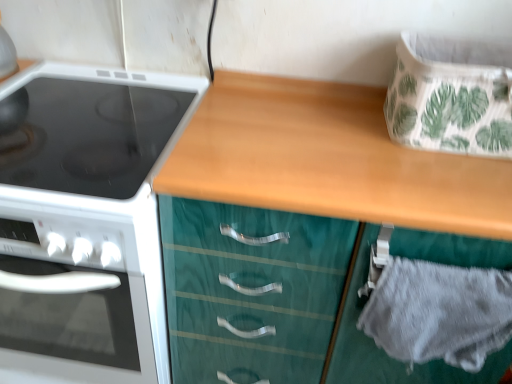
What do you see at coordinates (86, 219) in the screenshot? I see `white glossy electric stove at left` at bounding box center [86, 219].

The width and height of the screenshot is (512, 384). I want to click on teal wood cabinet at center, the 1th cabinetry in the front-to-back sequence, so click(252, 290).

The width and height of the screenshot is (512, 384). I want to click on white glossy electric stove at left, so click(x=86, y=219).

From the image's perspective, is gray fabric drawer at lower right, which ranks as the 2th cabinetry in front-to-back order, on top of white glossy electric stove at left?

Yes, from the image's perspective, gray fabric drawer at lower right, which ranks as the 2th cabinetry in front-to-back order, is above white glossy electric stove at left.

Is gray fabric drawer at lower right, the 1th cabinetry from the back, completely or partially outside of white glossy electric stove at left?

Yes, gray fabric drawer at lower right, the 1th cabinetry from the back, is outside of white glossy electric stove at left.

Is gray fabric drawer at lower right, which ranks as the 2th cabinetry in front-to-back order, shorter than white glossy electric stove at left?

Correct, gray fabric drawer at lower right, which ranks as the 2th cabinetry in front-to-back order, is not as tall as white glossy electric stove at left.

Between gray fabric drawer at lower right, the 1th cabinetry from the back, and white glossy electric stove at left, which one appears on the left side from the viewer's perspective?

white glossy electric stove at left is more to the left.

Between point (445, 246) and point (161, 218), which one is positioned behind?

The point (161, 218) is behind.

Can you see gray fabric drawer at lower right, which ranks as the 2th cabinetry in front-to-back order, touching teal wood cabinet at center, placed as the 2th cabinetry when sorted from back to front?

gray fabric drawer at lower right, which ranks as the 2th cabinetry in front-to-back order, and teal wood cabinet at center, placed as the 2th cabinetry when sorted from back to front, are clearly separated.

Would you say gray fabric drawer at lower right, which ranks as the 2th cabinetry in front-to-back order, is outside teal wood cabinet at center, placed as the 2th cabinetry when sorted from back to front?

That's incorrect, gray fabric drawer at lower right, which ranks as the 2th cabinetry in front-to-back order, is not completely outside teal wood cabinet at center, placed as the 2th cabinetry when sorted from back to front.

Could you measure the distance between gray fabric drawer at lower right, which ranks as the 2th cabinetry in front-to-back order, and teal wood cabinet at center, placed as the 2th cabinetry when sorted from back to front?

4.84 inches.

Does white glossy electric stove at left turn towards teal wood cabinet at center, placed as the 2th cabinetry when sorted from back to front?

No, white glossy electric stove at left is not turned towards teal wood cabinet at center, placed as the 2th cabinetry when sorted from back to front.

Does white glossy electric stove at left come behind teal wood cabinet at center, the 1th cabinetry in the front-to-back sequence?

Yes.

Does point (130, 140) appear closer or farther from the camera than point (458, 251)?

Point (130, 140) is positioned farther from the camera compared to point (458, 251).

Does point (254, 357) come closer to viewer compared to point (118, 335)?

No, it is not.

How many degrees apart are the facing directions of teal wood cabinet at center, placed as the 2th cabinetry when sorted from back to front, and white glossy electric stove at left?

There is a 0.000492-degree angle between the facing directions of teal wood cabinet at center, placed as the 2th cabinetry when sorted from back to front, and white glossy electric stove at left.

From the image's perspective, is teal wood cabinet at center, the 1th cabinetry in the front-to-back sequence, on white glossy electric stove at left?

Yes, from the image's perspective, teal wood cabinet at center, the 1th cabinetry in the front-to-back sequence, is above white glossy electric stove at left.

Could you tell me if teal wood cabinet at center, the 1th cabinetry in the front-to-back sequence, is turned towards white glossy electric stove at left?

No, teal wood cabinet at center, the 1th cabinetry in the front-to-back sequence, is not facing towards white glossy electric stove at left.

Does point (188, 213) come in front of point (398, 365)?

That is True.

Does teal wood cabinet at center, the 1th cabinetry in the front-to-back sequence, touch gray fabric drawer at lower right, the 1th cabinetry from the back?

No.

Is teal wood cabinet at center, placed as the 2th cabinetry when sorted from back to front, shorter than gray fabric drawer at lower right, which ranks as the 2th cabinetry in front-to-back order?

No, teal wood cabinet at center, placed as the 2th cabinetry when sorted from back to front, is not shorter than gray fabric drawer at lower right, which ranks as the 2th cabinetry in front-to-back order.

Would you say teal wood cabinet at center, placed as the 2th cabinetry when sorted from back to front, is to the left or to the right of gray fabric drawer at lower right, which ranks as the 2th cabinetry in front-to-back order, in the picture?

teal wood cabinet at center, placed as the 2th cabinetry when sorted from back to front, is positioned on gray fabric drawer at lower right, which ranks as the 2th cabinetry in front-to-back order,'s left side.

Is the surface of white glossy electric stove at left in direct contact with gray fabric drawer at lower right, which ranks as the 2th cabinetry in front-to-back order?

No.

From a real-world perspective, relative to gray fabric drawer at lower right, which ranks as the 2th cabinetry in front-to-back order, is white glossy electric stove at left vertically above or below?

From a real-world perspective, white glossy electric stove at left is physically below gray fabric drawer at lower right, which ranks as the 2th cabinetry in front-to-back order.

Based on the photo, is white glossy electric stove at left positioned behind gray fabric drawer at lower right, the 1th cabinetry from the back?

Yes, white glossy electric stove at left is further from the viewer.

You are a GUI agent. You are given a task and a screenshot of the screen. Output one action in this format:
    pyautogui.click(x=<x>, y=<y>)
    Task: Click on the kitchen appliance located underneath the gray fabric drawer at lower right, which ranks as the 2th cabinetry in front-to-back order (from a real-world perspective)
    
    Given the screenshot: What is the action you would take?
    pyautogui.click(x=86, y=219)

This screenshot has width=512, height=384. In order to click on cabinetry lying below the teal wood cabinet at center, placed as the 2th cabinetry when sorted from back to front (from the image's perspective) in this screenshot , I will do `click(384, 353)`.

Based on their spatial positions, is white glossy electric stove at left or teal wood cabinet at center, the 1th cabinetry in the front-to-back sequence, further from gray fabric drawer at lower right, the 1th cabinetry from the back?

white glossy electric stove at left lies further to gray fabric drawer at lower right, the 1th cabinetry from the back, than the other object.

Looking at this image, which object lies further to the anchor point white glossy electric stove at left, gray fabric drawer at lower right, the 1th cabinetry from the back, or teal wood cabinet at center, placed as the 2th cabinetry when sorted from back to front?

gray fabric drawer at lower right, the 1th cabinetry from the back.

Estimate the real-world distances between objects in this image. Which object is closer to gray fabric drawer at lower right, which ranks as the 2th cabinetry in front-to-back order, teal wood cabinet at center, the 1th cabinetry in the front-to-back sequence, or white glossy electric stove at left?

The object closer to gray fabric drawer at lower right, which ranks as the 2th cabinetry in front-to-back order, is teal wood cabinet at center, the 1th cabinetry in the front-to-back sequence.

From the image, which object appears to be farther from teal wood cabinet at center, placed as the 2th cabinetry when sorted from back to front, white glossy electric stove at left or gray fabric drawer at lower right, the 1th cabinetry from the back?

Based on the image, white glossy electric stove at left appears to be further to teal wood cabinet at center, placed as the 2th cabinetry when sorted from back to front.

From the image, which object appears to be farther from teal wood cabinet at center, placed as the 2th cabinetry when sorted from back to front, gray fabric drawer at lower right, which ranks as the 2th cabinetry in front-to-back order, or white glossy electric stove at left?

white glossy electric stove at left.

Looking at this image, from the image, which object appears to be nearer to white glossy electric stove at left, teal wood cabinet at center, the 1th cabinetry in the front-to-back sequence, or gray fabric drawer at lower right, which ranks as the 2th cabinetry in front-to-back order?

teal wood cabinet at center, the 1th cabinetry in the front-to-back sequence, is closer to white glossy electric stove at left.

The width and height of the screenshot is (512, 384). I want to click on cabinetry between white glossy electric stove at left and gray fabric drawer at lower right, the 1th cabinetry from the back, in the horizontal direction, so click(x=252, y=290).